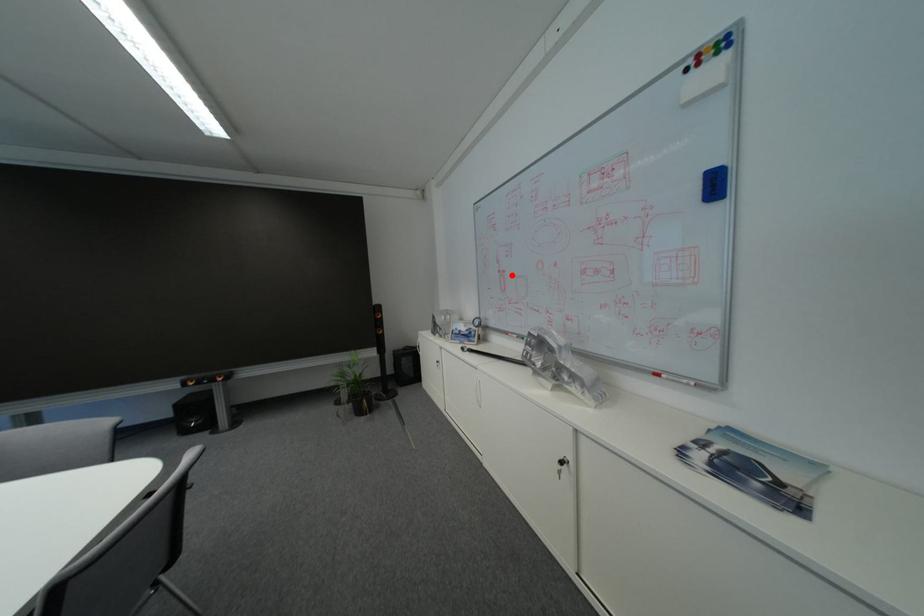
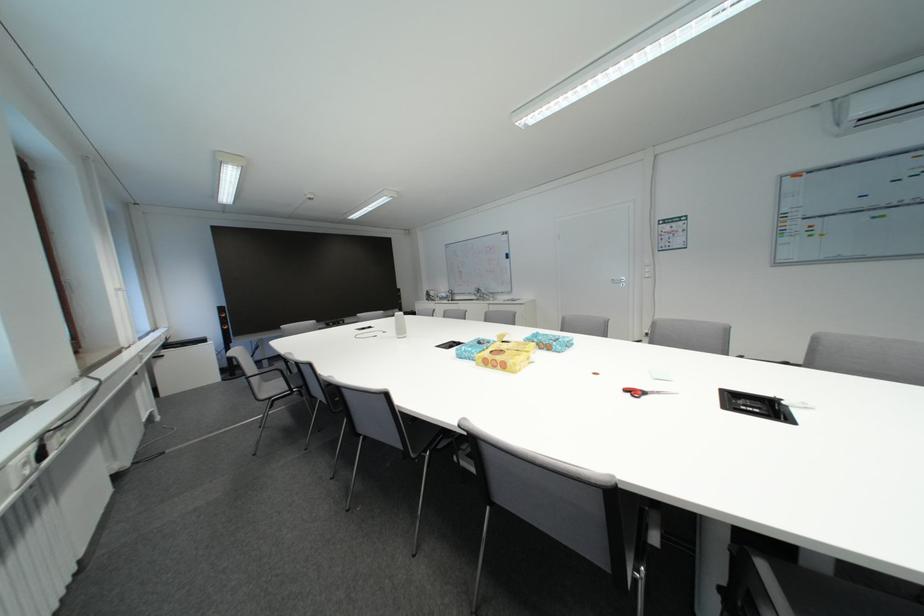
In the second image, find the point that corresponds to the highlighted location in the first image.

(470, 275)